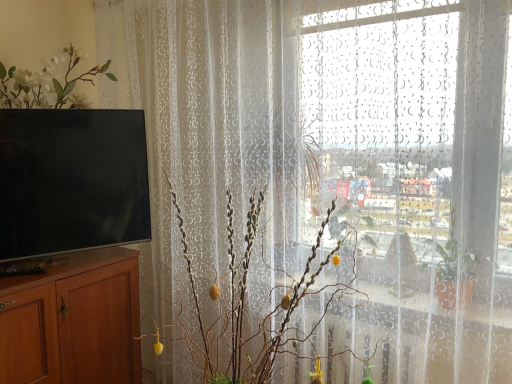
Question: Is brown wood cabinet at left positioned with its back to silvery metallic branches at center?

Choices:
 (A) no
 (B) yes

Answer: (A)

Question: Can you confirm if brown wood cabinet at left is smaller than silvery metallic branches at center?

Choices:
 (A) no
 (B) yes

Answer: (B)

Question: Is the position of brown wood cabinet at left more distant than that of silvery metallic branches at center?

Choices:
 (A) no
 (B) yes

Answer: (B)

Question: Is silvery metallic branches at center located within brown wood cabinet at left?

Choices:
 (A) no
 (B) yes

Answer: (A)

Question: Can you confirm if brown wood cabinet at left is positioned to the left of silvery metallic branches at center?

Choices:
 (A) yes
 (B) no

Answer: (A)

Question: Which is correct: brown wood cabinet at left is inside matte black tv at left, or outside of it?

Choices:
 (A) outside
 (B) inside

Answer: (A)

Question: Is brown wood cabinet at left taller or shorter than matte black tv at left?

Choices:
 (A) tall
 (B) short

Answer: (A)

Question: From the image's perspective, is brown wood cabinet at left located above or below matte black tv at left?

Choices:
 (A) below
 (B) above

Answer: (A)

Question: In terms of size, does brown wood cabinet at left appear bigger or smaller than matte black tv at left?

Choices:
 (A) small
 (B) big

Answer: (B)

Question: From a real-world perspective, is brown wood cabinet at left positioned above or below silvery metallic branches at center?

Choices:
 (A) above
 (B) below

Answer: (B)

Question: Does point (130, 266) appear closer or farther from the camera than point (258, 362)?

Choices:
 (A) closer
 (B) farther

Answer: (B)

Question: In terms of size, does brown wood cabinet at left appear bigger or smaller than silvery metallic branches at center?

Choices:
 (A) small
 (B) big

Answer: (A)

Question: Relative to silvery metallic branches at center, is brown wood cabinet at left in front or behind?

Choices:
 (A) behind
 (B) front

Answer: (A)

Question: Visually, is matte black tv at left positioned to the left or to the right of silvery metallic branches at center?

Choices:
 (A) left
 (B) right

Answer: (A)

Question: From a real-world perspective, is matte black tv at left physically located above or below silvery metallic branches at center?

Choices:
 (A) below
 (B) above

Answer: (B)